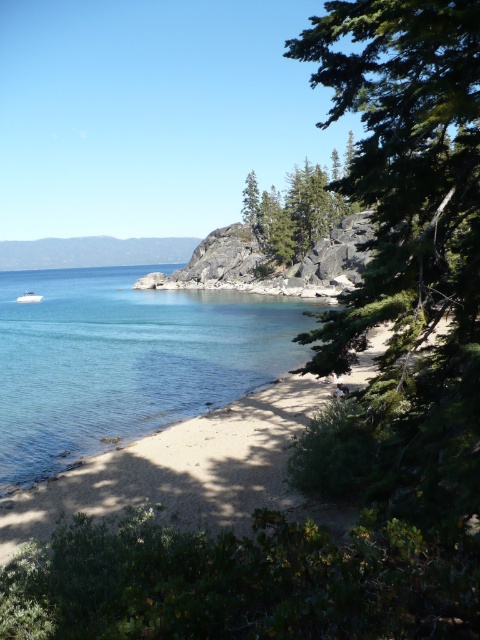
From the picture: You are standing at the center of the beach looking towards the shoreline. There is a point marked at coordinates (126, 358). What is located at that point?

At point (126, 358) lies clear water at lower left.

You are standing on the beach and see the clear water at lower left and the white glossy boat at lower left. Which object is positioned lower in the scene?

The clear water at lower left is located below the white glossy boat at lower left, so it is positioned lower in the scene.

You are standing on the beach and want to take a photo of both the point at coordinates point (121,266) and the point at coordinates point (286,225). Which point should you focus on first to ensure both are in focus?

You should focus on the point at coordinates point (121,266) first because it is closer to you than the point at coordinates point (286,225), ensuring both are in focus.